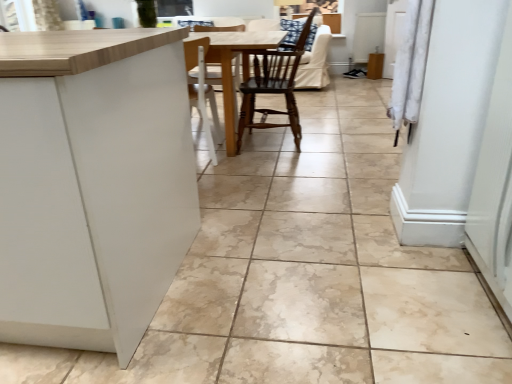
Question: Considering the relative sizes of wooden table at center and wooden chair at center in the image provided, is wooden table at center shorter than wooden chair at center?

Choices:
 (A) yes
 (B) no

Answer: (A)

Question: From a real-world perspective, is wooden table at center located beneath wooden chair at center?

Choices:
 (A) yes
 (B) no

Answer: (A)

Question: From a real-world perspective, is wooden table at center physically above wooden chair at center?

Choices:
 (A) yes
 (B) no

Answer: (B)

Question: Does wooden table at center turn towards wooden chair at center?

Choices:
 (A) no
 (B) yes

Answer: (A)

Question: From the image's perspective, is wooden table at center located above wooden chair at center?

Choices:
 (A) yes
 (B) no

Answer: (B)

Question: Does wooden table at center have a greater width compared to wooden chair at center?

Choices:
 (A) yes
 (B) no

Answer: (A)

Question: From the image's perspective, would you say wooden chair at center is shown under wooden table at center?

Choices:
 (A) no
 (B) yes

Answer: (A)

Question: Considering the relative positions of wooden chair at center and wooden table at center in the image provided, is wooden chair at center to the right of wooden table at center from the viewer's perspective?

Choices:
 (A) no
 (B) yes

Answer: (B)

Question: Is wooden chair at center shorter than wooden table at center?

Choices:
 (A) yes
 (B) no

Answer: (B)

Question: From a real-world perspective, is wooden chair at center physically below wooden table at center?

Choices:
 (A) yes
 (B) no

Answer: (B)

Question: Considering the relative sizes of wooden chair at center and wooden table at center in the image provided, is wooden chair at center taller than wooden table at center?

Choices:
 (A) no
 (B) yes

Answer: (B)

Question: Is wooden chair at center not close to wooden table at center?

Choices:
 (A) yes
 (B) no

Answer: (B)

Question: Is point (246, 109) positioned closer to the camera than point (250, 36)?

Choices:
 (A) closer
 (B) farther

Answer: (B)